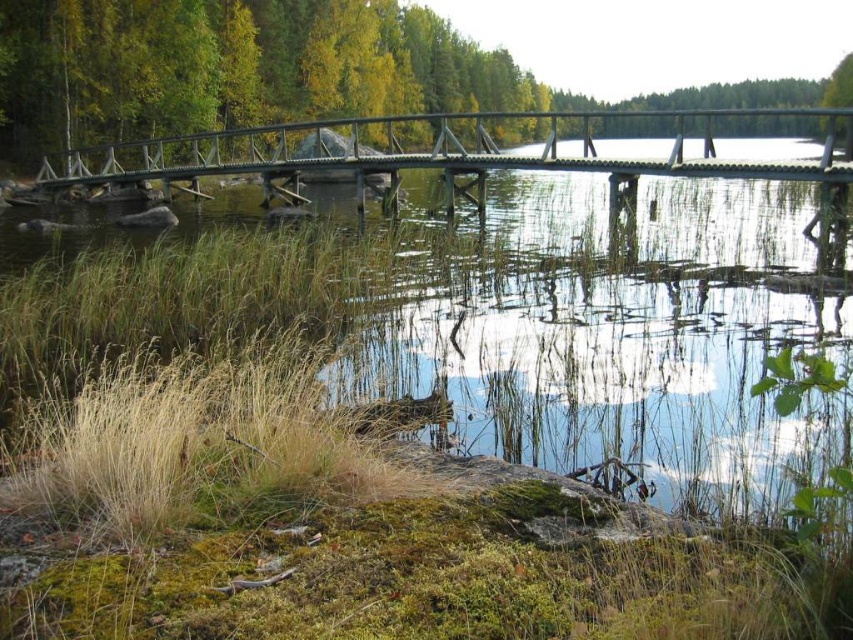
Question: Which of the following is the farthest from the observer?

Choices:
 (A) wooden bridge at center
 (B) green matte tree at upper center

Answer: (B)

Question: Which of the following is the closest to the observer?

Choices:
 (A) wooden bridge at center
 (B) green matte tree at upper center

Answer: (A)

Question: Is green matte tree at upper center behind wooden bridge at center?

Choices:
 (A) no
 (B) yes

Answer: (B)

Question: Does green matte tree at upper center come behind wooden bridge at center?

Choices:
 (A) no
 (B) yes

Answer: (B)

Question: Is green matte tree at upper center thinner than wooden bridge at center?

Choices:
 (A) no
 (B) yes

Answer: (A)